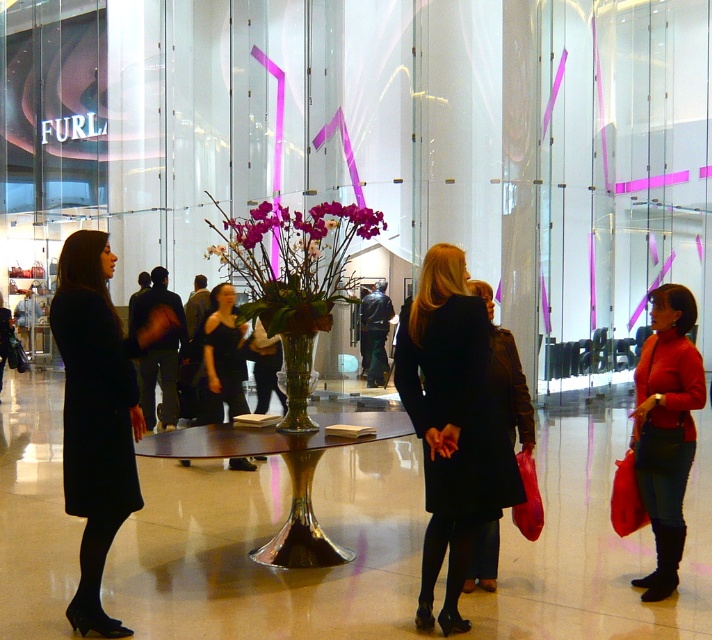
Question: Which point is farther from the camera taking this photo?

Choices:
 (A) (384, 436)
 (B) (224, 362)

Answer: (B)

Question: Can you confirm if black matte coat at center is wider than matte black coat at left?

Choices:
 (A) no
 (B) yes

Answer: (A)

Question: Is matte black coat at left wider than matte red sweater at right?

Choices:
 (A) no
 (B) yes

Answer: (B)

Question: Which object is farther from the camera taking this photo?

Choices:
 (A) matte black coat at center
 (B) matte black coat at left

Answer: (A)

Question: Which object appears closest to the camera in this image?

Choices:
 (A) metallic gold table at center
 (B) matte black coat at left
 (C) matte black coat at center
 (D) black dress at center

Answer: (B)

Question: Is black matte coat at center thinner than matte black coat at center?

Choices:
 (A) yes
 (B) no

Answer: (B)